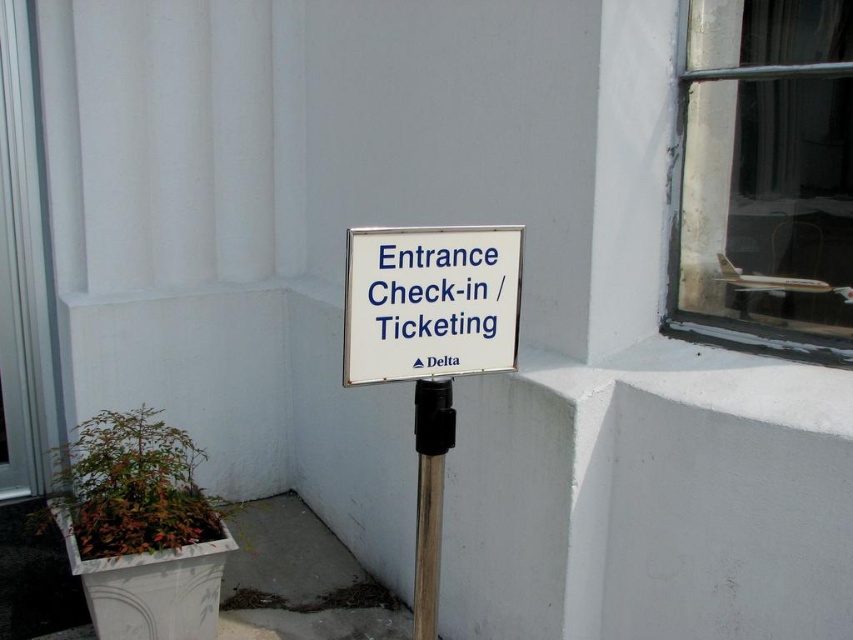
Consider the image. You are standing at the entrance of the building and want to reach a specific point marked at coordinates point [416,253]. If your walking distance from your current position to that point is 2 meters, will you be able to reach it without moving further than 1.5 meters?

The distance of point [416,253] from viewer is 1.52 meters. Since 1.52 meters is slightly more than 1.5 meters, you will need to move a little further than 1.5 meters to reach it.

You are standing in front of the building and want to reach the entrance check in area. The white plastic sign at center indicates the direction. Is the metallic pole at center blocking your path to the sign?

The white plastic sign at center is in front of the metallic pole at center, so the pole is behind the sign and not blocking your path.